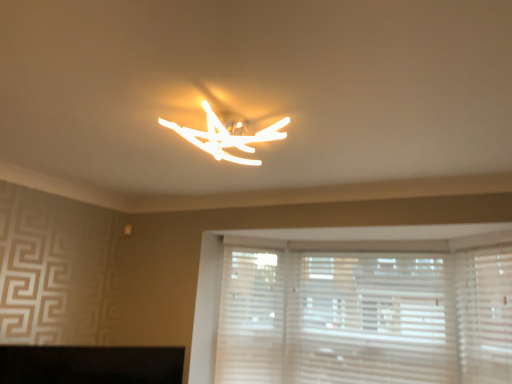
Describe the element at coordinates (371, 319) in the screenshot. Image resolution: width=512 pixels, height=384 pixels. I see `white textured blinds at lower right` at that location.

Find the location of `white matte shutter at lower center, arranged as the first shutter when viewed from the left`. white matte shutter at lower center, arranged as the first shutter when viewed from the left is located at coordinates (250, 317).

Is white matte shutter at lower center, arranged as the first shutter when viewed from the left, next to white matte shutter at right, positioned as the first shutter in right-to-left order, and touching it?

white matte shutter at lower center, arranged as the first shutter when viewed from the left, and white matte shutter at right, positioned as the first shutter in right-to-left order, are not in contact.

From the image's perspective, between white matte shutter at lower center, arranged as the 2th shutter when viewed from the right, and white matte shutter at right, marked as the first shutter in a front-to-back arrangement, which one is located above?

white matte shutter at right, marked as the first shutter in a front-to-back arrangement.

Is white matte shutter at lower center, positioned as the second shutter in front-to-back order, aimed at white matte shutter at right, the 2th shutter from the left?

No, white matte shutter at lower center, positioned as the second shutter in front-to-back order, does not turn towards white matte shutter at right, the 2th shutter from the left.

Is point (279, 258) positioned behind point (460, 282)?

Yes, point (279, 258) is farther from viewer.

Is point (223, 343) less distant than point (383, 255)?

No, (223, 343) is further to viewer.

Does white matte shutter at lower center, arranged as the 2th shutter when viewed from the right, have a smaller size compared to white textured blinds at lower right?

Yes.

Considering the relative positions of white matte shutter at lower center, which is the 1th shutter in back-to-front order, and white textured blinds at lower right in the image provided, is white matte shutter at lower center, which is the 1th shutter in back-to-front order, to the left of white textured blinds at lower right from the viewer's perspective?

Yes.

Where is `shutter below the white textured blinds at lower right (from the image's perspective)`? The image size is (512, 384). shutter below the white textured blinds at lower right (from the image's perspective) is located at coordinates (250, 317).

Is white matte shutter at right, which is counted as the 2th shutter, starting from the back, not close to matte white light fixture at center?

Yes, white matte shutter at right, which is counted as the 2th shutter, starting from the back, and matte white light fixture at center are located far from each other.

In terms of height, does white matte shutter at right, the 2th shutter from the left, look taller or shorter compared to matte white light fixture at center?

Considering their sizes, white matte shutter at right, the 2th shutter from the left, has more height than matte white light fixture at center.

Is point (494, 317) closer or farther from the camera than point (205, 105)?

Point (494, 317) is positioned farther from the camera compared to point (205, 105).

Is white matte shutter at right, marked as the first shutter in a front-to-back arrangement, bigger than matte white light fixture at center?

Yes, white matte shutter at right, marked as the first shutter in a front-to-back arrangement, is bigger than matte white light fixture at center.

Can we say white matte shutter at lower center, arranged as the 2th shutter when viewed from the right, lies outside matte white light fixture at center?

Yes.

Does white matte shutter at lower center, arranged as the 2th shutter when viewed from the right, appear on the right side of matte white light fixture at center?

Yes.

Considering the relative sizes of white matte shutter at lower center, arranged as the 2th shutter when viewed from the right, and matte white light fixture at center in the image provided, is white matte shutter at lower center, arranged as the 2th shutter when viewed from the right, shorter than matte white light fixture at center?

Incorrect, the height of white matte shutter at lower center, arranged as the 2th shutter when viewed from the right, does not fall short of that of matte white light fixture at center.

Can you confirm if white matte shutter at lower center, arranged as the first shutter when viewed from the left, is bigger than matte white light fixture at center?

Indeed, white matte shutter at lower center, arranged as the first shutter when viewed from the left, has a larger size compared to matte white light fixture at center.

Can you confirm if white matte shutter at right, which is counted as the 2th shutter, starting from the back, is positioned to the left of white textured blinds at lower right?

No, white matte shutter at right, which is counted as the 2th shutter, starting from the back, is not to the left of white textured blinds at lower right.

Is the depth of white matte shutter at right, which is counted as the 2th shutter, starting from the back, greater than that of white textured blinds at lower right?

No, the depth of white matte shutter at right, which is counted as the 2th shutter, starting from the back, is less than that of white textured blinds at lower right.

Is white matte shutter at right, which is counted as the 2th shutter, starting from the back, oriented towards white textured blinds at lower right?

No.

Looking at the image, does white matte shutter at right, marked as the first shutter in a front-to-back arrangement, seem bigger or smaller compared to white textured blinds at lower right?

In the image, white matte shutter at right, marked as the first shutter in a front-to-back arrangement, appears to be smaller than white textured blinds at lower right.

From a real-world perspective, is white matte shutter at right, positioned as the first shutter in right-to-left order, positioned above or below white matte shutter at lower center, arranged as the 2th shutter when viewed from the right?

Clearly, from a real-world perspective, white matte shutter at right, positioned as the first shutter in right-to-left order, is above white matte shutter at lower center, arranged as the 2th shutter when viewed from the right.

Between white matte shutter at right, marked as the first shutter in a front-to-back arrangement, and white matte shutter at lower center, arranged as the 2th shutter when viewed from the right, which one appears on the right side from the viewer's perspective?

white matte shutter at right, marked as the first shutter in a front-to-back arrangement.

This screenshot has height=384, width=512. Identify the location of shutter behind the white matte shutter at right, marked as the first shutter in a front-to-back arrangement. [250, 317].

What's the angular difference between white matte shutter at right, which is counted as the 2th shutter, starting from the back, and white matte shutter at lower center, arranged as the first shutter when viewed from the left,'s facing directions?

white matte shutter at right, which is counted as the 2th shutter, starting from the back, and white matte shutter at lower center, arranged as the first shutter when viewed from the left, are facing 91.8 degrees away from each other.

How different are the orientations of matte white light fixture at center and white matte shutter at right, positioned as the first shutter in right-to-left order, in degrees?

matte white light fixture at center and white matte shutter at right, positioned as the first shutter in right-to-left order, are facing 47.7 degrees away from each other.

Considering the relative sizes of matte white light fixture at center and white matte shutter at right, marked as the first shutter in a front-to-back arrangement, in the image provided, is matte white light fixture at center shorter than white matte shutter at right, marked as the first shutter in a front-to-back arrangement,?

Yes, matte white light fixture at center is shorter than white matte shutter at right, marked as the first shutter in a front-to-back arrangement.

From a real-world perspective, is matte white light fixture at center positioned above or below white matte shutter at right, the 2th shutter from the left?

From a real-world perspective, matte white light fixture at center is physically above white matte shutter at right, the 2th shutter from the left.

Locate an element on the screen. The height and width of the screenshot is (384, 512). shutter lying in front of the white matte shutter at lower center, which is the 1th shutter in back-to-front order is located at coordinates (484, 314).

At what (x,y) coordinates should I click in order to perform the action: click on shutter behind the white textured blinds at lower right. Please return your answer as a coordinate pair (x, y). The image size is (512, 384). Looking at the image, I should click on (250, 317).

Which object lies further to the anchor point white textured blinds at lower right, matte white light fixture at center or white matte shutter at lower center, arranged as the 2th shutter when viewed from the right?

Among the two, matte white light fixture at center is located further to white textured blinds at lower right.

When comparing their distances from white textured blinds at lower right, does matte white light fixture at center or white matte shutter at right, marked as the first shutter in a front-to-back arrangement, seem further?

Among the two, matte white light fixture at center is located further to white textured blinds at lower right.

When comparing their distances from white textured blinds at lower right, does white matte shutter at lower center, positioned as the second shutter in front-to-back order, or white matte shutter at right, positioned as the first shutter in right-to-left order, seem further?

white matte shutter at lower center, positioned as the second shutter in front-to-back order, is further to white textured blinds at lower right.

Looking at the image, which one is located closer to white matte shutter at lower center, positioned as the second shutter in front-to-back order, white matte shutter at right, marked as the first shutter in a front-to-back arrangement, or white textured blinds at lower right?

Among the two, white textured blinds at lower right is located nearer to white matte shutter at lower center, positioned as the second shutter in front-to-back order.

Based on their spatial positions, is matte white light fixture at center or white textured blinds at lower right further from white matte shutter at lower center, which is the 1th shutter in back-to-front order?

Among the two, matte white light fixture at center is located further to white matte shutter at lower center, which is the 1th shutter in back-to-front order.

When comparing their distances from white matte shutter at right, which is counted as the 2th shutter, starting from the back, does white matte shutter at lower center, arranged as the 2th shutter when viewed from the right, or matte white light fixture at center seem closer?

Among the two, white matte shutter at lower center, arranged as the 2th shutter when viewed from the right, is located nearer to white matte shutter at right, which is counted as the 2th shutter, starting from the back.

Considering their positions, is white matte shutter at right, the 2th shutter from the left, positioned further to matte white light fixture at center than white matte shutter at lower center, positioned as the second shutter in front-to-back order?

white matte shutter at right, the 2th shutter from the left.

From the image, which object appears to be nearer to matte white light fixture at center, white matte shutter at right, which is counted as the 2th shutter, starting from the back, or white textured blinds at lower right?

white textured blinds at lower right is positioned closer to the anchor matte white light fixture at center.

You are a GUI agent. You are given a task and a screenshot of the screen. Output one action in this format:
    pyautogui.click(x=<x>, y=<y>)
    Task: Click on the blind between matte white light fixture at center and white matte shutter at right, positioned as the first shutter in right-to-left order, from left to right
    
    Given the screenshot: What is the action you would take?
    pyautogui.click(x=371, y=319)

Where is `blind between matte white light fixture at center and white matte shutter at lower center, arranged as the 2th shutter when viewed from the right, in the front-back direction`? blind between matte white light fixture at center and white matte shutter at lower center, arranged as the 2th shutter when viewed from the right, in the front-back direction is located at coordinates (371, 319).

Locate an element on the screen. The width and height of the screenshot is (512, 384). blind between white matte shutter at lower center, arranged as the 2th shutter when viewed from the right, and white matte shutter at right, positioned as the first shutter in right-to-left order, from left to right is located at coordinates (371, 319).

Find the location of a particular element. This screenshot has height=384, width=512. shutter between matte white light fixture at center and white matte shutter at right, which is counted as the 2th shutter, starting from the back, in the horizontal direction is located at coordinates (250, 317).